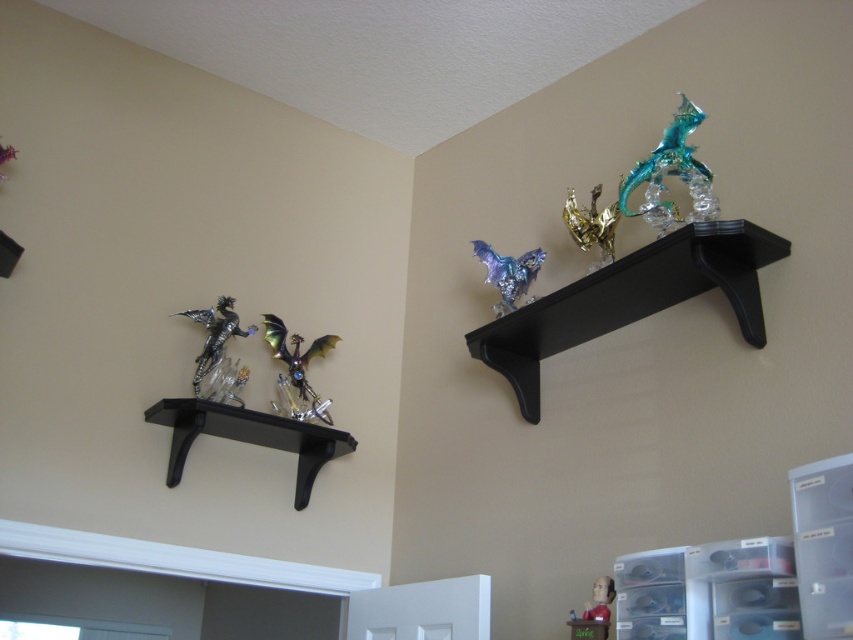
Question: In this image, where is black glossy shelf at upper right located relative to black matte shelf at lower left?

Choices:
 (A) above
 (B) below

Answer: (A)

Question: Which point is closer to the camera?

Choices:
 (A) [537, 416]
 (B) [177, 404]

Answer: (B)

Question: Which point is closer to the camera?

Choices:
 (A) black glossy shelf at upper right
 (B) black matte shelf at lower left

Answer: (A)

Question: Is black glossy shelf at upper right positioned at the back of black matte shelf at lower left?

Choices:
 (A) yes
 (B) no

Answer: (B)

Question: Among these objects, which one is nearest to the camera?

Choices:
 (A) black matte shelf at lower left
 (B) black glossy shelf at upper right

Answer: (B)

Question: Is black glossy shelf at upper right above black matte shelf at lower left?

Choices:
 (A) no
 (B) yes

Answer: (B)